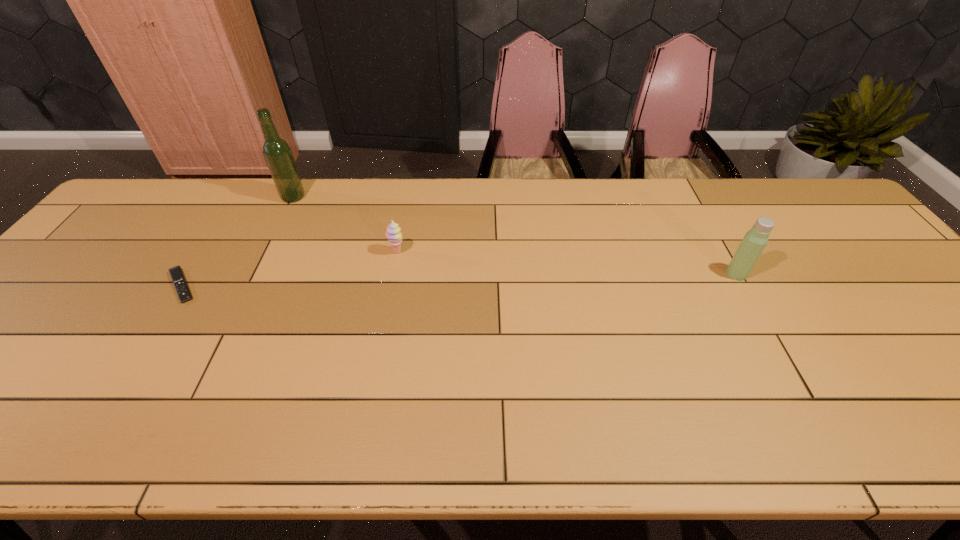
Locate an element on the screen. The height and width of the screenshot is (540, 960). free space located on the back of the second object from right to left is located at coordinates (403, 220).

I want to click on vacant space located on the front of the remote control, so click(x=140, y=351).

At what (x,y) coordinates should I click in order to perform the action: click on object positioned at the far edge. Please return your answer as a coordinate pair (x, y). This screenshot has height=540, width=960. Looking at the image, I should click on (277, 153).

I want to click on blank area at the far edge, so click(348, 210).

Where is `free space at the near edge`? free space at the near edge is located at coordinates (522, 428).

This screenshot has height=540, width=960. In order to click on free space at the right edge of the desktop in this screenshot , I will do pyautogui.click(x=873, y=290).

Where is `free space at the far left corner of the desktop`? This screenshot has width=960, height=540. free space at the far left corner of the desktop is located at coordinates (153, 185).

Find the location of a particular element. This screenshot has height=540, width=960. vacant space at the far right corner of the desktop is located at coordinates (793, 193).

You are a GUI agent. You are given a task and a screenshot of the screen. Output one action in this format:
    pyautogui.click(x=<x>, y=<y>)
    Task: Click on the vacant space in between the third tallest object and the second tallest object
    This screenshot has height=540, width=960.
    Given the screenshot: What is the action you would take?
    pyautogui.click(x=566, y=263)

Locate an element on the screen. The image size is (960, 540). empty location between the second shortest object and the second object from left to right is located at coordinates (345, 225).